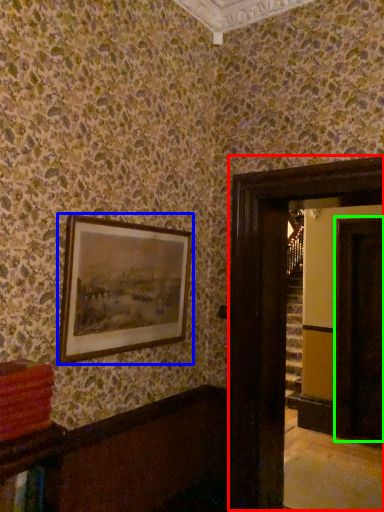
Question: Which is farther away from glass door (highlighted by a red box)? picture frame (highlighted by a blue box) or glass door (highlighted by a green box)?

Choices:
 (A) picture frame
 (B) glass door

Answer: (B)